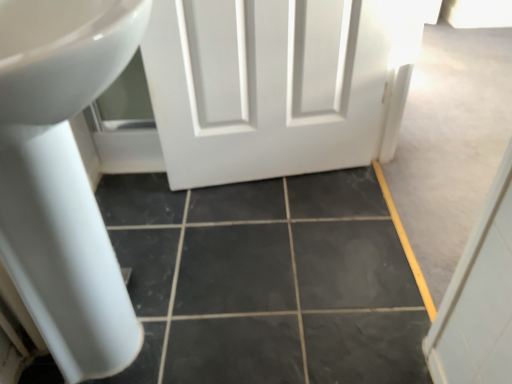
Question: From a real-world perspective, is white glossy sink at left positioned over black marble tile at center based on gravity?

Choices:
 (A) no
 (B) yes

Answer: (B)

Question: Is white glossy sink at left looking in the opposite direction of black marble tile at center?

Choices:
 (A) yes
 (B) no

Answer: (B)

Question: Is white glossy sink at left at the left side of black marble tile at center?

Choices:
 (A) no
 (B) yes

Answer: (B)

Question: From a real-world perspective, is white glossy sink at left positioned under black marble tile at center based on gravity?

Choices:
 (A) no
 (B) yes

Answer: (A)

Question: Is white glossy sink at left positioned behind black marble tile at center?

Choices:
 (A) yes
 (B) no

Answer: (B)

Question: Is white glossy sink at left taller than black marble tile at center?

Choices:
 (A) no
 (B) yes

Answer: (B)

Question: Is black marble tile at center touching white glossy sink at left?

Choices:
 (A) no
 (B) yes

Answer: (A)

Question: Is black marble tile at center to the left of white glossy sink at left from the viewer's perspective?

Choices:
 (A) no
 (B) yes

Answer: (A)

Question: From the image's perspective, is black marble tile at center on white glossy sink at left?

Choices:
 (A) yes
 (B) no

Answer: (B)

Question: Considering the relative sizes of black marble tile at center and white glossy sink at left in the image provided, is black marble tile at center bigger than white glossy sink at left?

Choices:
 (A) yes
 (B) no

Answer: (B)

Question: Considering the relative positions of black marble tile at center and white glossy sink at left in the image provided, is black marble tile at center in front of white glossy sink at left?

Choices:
 (A) yes
 (B) no

Answer: (B)

Question: Can you confirm if black marble tile at center is positioned to the right of white glossy sink at left?

Choices:
 (A) no
 (B) yes

Answer: (B)

Question: From the image's perspective, is white glossy sink at left positioned above or below black marble tile at center?

Choices:
 (A) below
 (B) above

Answer: (B)